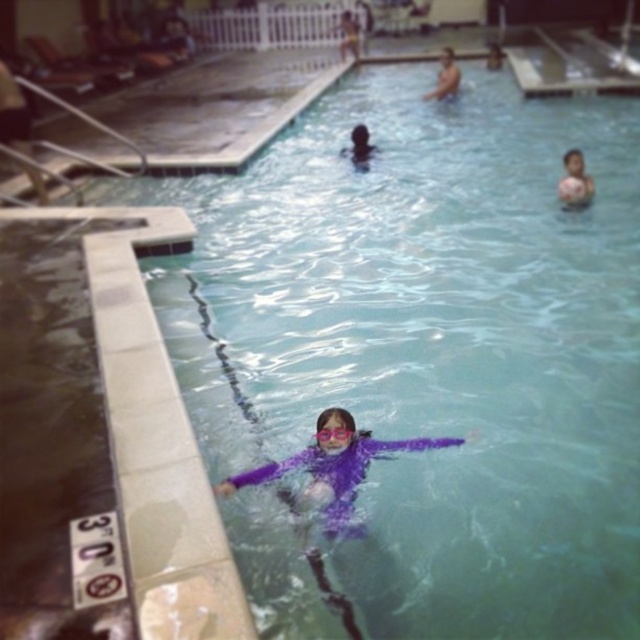
Can you confirm if purple rubberized swimsuit at center is smaller than smooth skin person at upper center?

Incorrect, purple rubberized swimsuit at center is not smaller in size than smooth skin person at upper center.

Is point (348, 458) positioned behind point (442, 77)?

That is False.

This screenshot has height=640, width=640. What do you see at coordinates (333, 467) in the screenshot?
I see `purple rubberized swimsuit at center` at bounding box center [333, 467].

Where is `purple rubberized swimsuit at center`? This screenshot has height=640, width=640. purple rubberized swimsuit at center is located at coordinates coord(333,467).

Between smooth skin person at upper center and purple plastic goggles at center, which one appears on the left side from the viewer's perspective?

purple plastic goggles at center is more to the left.

Is point (442, 68) farther from viewer compared to point (340, 426)?

Yes.

Is point (442, 51) closer to viewer compared to point (326, 440)?

No, it is behind (326, 440).

Locate an element on the screen. The width and height of the screenshot is (640, 640). smooth skin person at upper center is located at coordinates (445, 76).

Can you confirm if purple rubberized swimsuit at center is bigger than purple plastic goggles at center?

Indeed, purple rubberized swimsuit at center has a larger size compared to purple plastic goggles at center.

Does point (365, 433) come farther from viewer compared to point (330, 438)?

Yes, point (365, 433) is behind point (330, 438).

Find the location of a particular element. purple rubberized swimsuit at center is located at coordinates (333, 467).